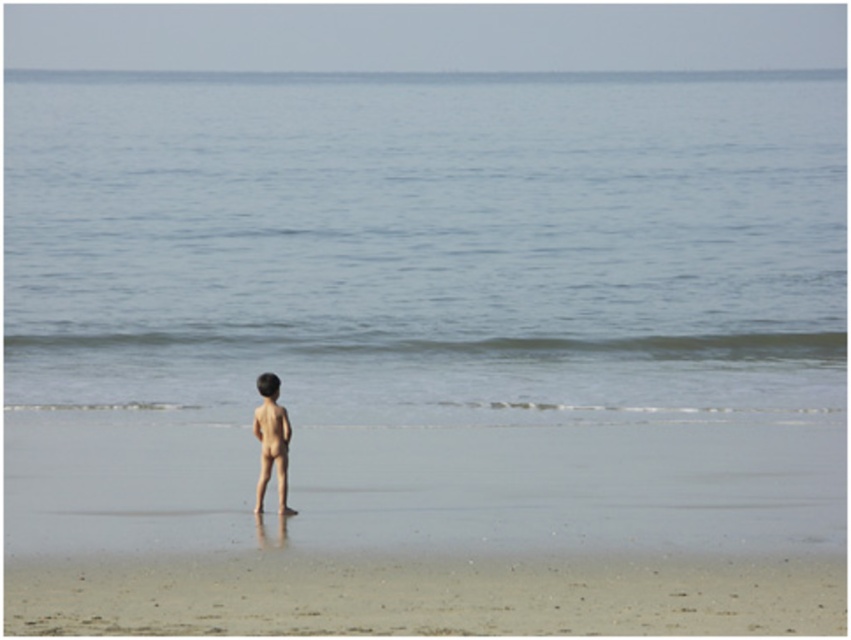
Between blue water at center and smooth skin boy at center, which one appears on the left side from the viewer's perspective?

smooth skin boy at center

What do you see at coordinates (426, 241) in the screenshot? This screenshot has height=640, width=851. I see `blue water at center` at bounding box center [426, 241].

What are the coordinates of `blue water at center` in the screenshot? It's located at (426, 241).

Does smooth sand at center have a lesser height compared to smooth skin boy at center?

Indeed, smooth sand at center has a lesser height compared to smooth skin boy at center.

What are the coordinates of `smooth sand at center` in the screenshot? It's located at (427, 525).

Measure the distance between point (770, 237) and camera.

Point (770, 237) and camera are 32.53 meters apart.

Does blue water at center appear on the left side of smooth sand at center?

In fact, blue water at center is to the right of smooth sand at center.

Is point (223, 330) closer to camera compared to point (150, 474)?

That is False.

Find the location of a particular element. blue water at center is located at coordinates point(426,241).